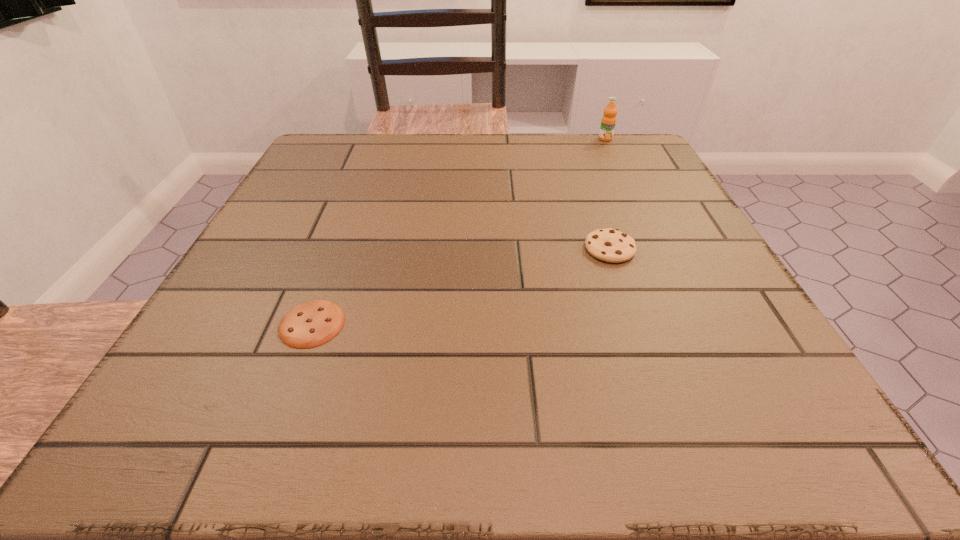
Find the location of a particular element. This screenshot has width=960, height=540. object that is positioned at the left edge is located at coordinates (310, 324).

Identify the location of orange juice that is at the right edge. Image resolution: width=960 pixels, height=540 pixels. (608, 122).

Where is `cookie positioned at the right edge`? The image size is (960, 540). cookie positioned at the right edge is located at coordinates (610, 245).

This screenshot has width=960, height=540. I want to click on object that is at the far right corner, so click(608, 122).

Where is `blank space at the far edge of the desktop`? This screenshot has width=960, height=540. blank space at the far edge of the desktop is located at coordinates (574, 142).

The height and width of the screenshot is (540, 960). Find the location of `vacant space at the near edge`. vacant space at the near edge is located at coordinates (385, 429).

Locate an element on the screen. vacant space at the left edge of the desktop is located at coordinates (292, 264).

This screenshot has height=540, width=960. In order to click on vacant area at the right edge of the desktop in this screenshot , I will do point(688,381).

The width and height of the screenshot is (960, 540). What are the coordinates of `vacant space at the far left corner of the desktop` in the screenshot? It's located at (368, 139).

In the image, there is a desktop. Where is `vacant space at the near left corner`? The height and width of the screenshot is (540, 960). vacant space at the near left corner is located at coordinates (129, 443).